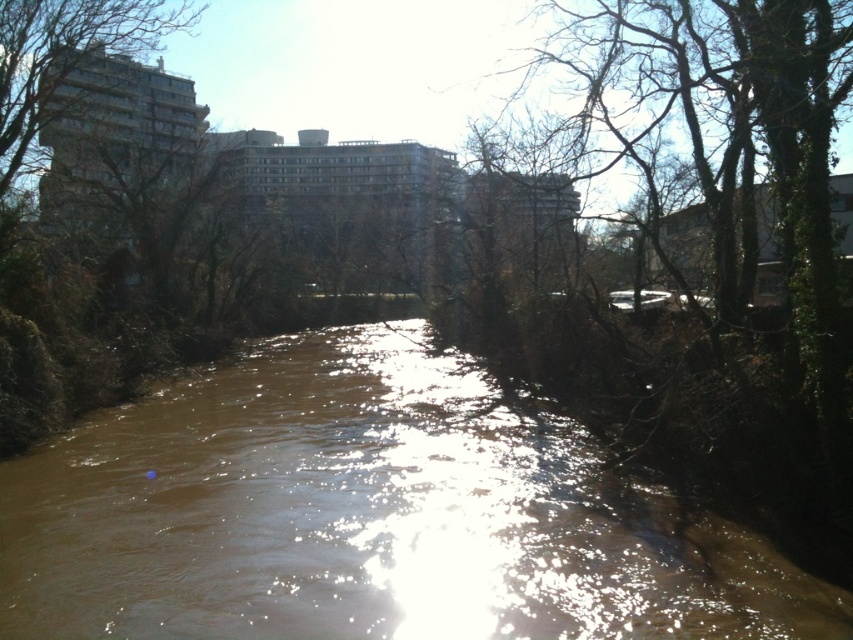
Which of these two, brown muddy water at center or green leafy tree at upper left, stands taller?

green leafy tree at upper left is taller.

Is point (585, 637) positioned before point (135, 49)?

Yes, it is.

Which is behind, point (660, 618) or point (106, 58)?

The point (106, 58) is behind.

Locate an element on the screen. Image resolution: width=853 pixels, height=640 pixels. brown muddy water at center is located at coordinates (370, 516).